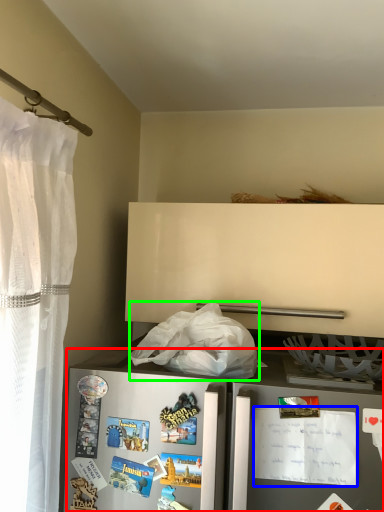
Question: Which object is the closest to the refrigerator (highlighted by a red box)? Choose among these: postcard (highlighted by a blue box) or plastic bag (highlighted by a green box).

Choices:
 (A) postcard
 (B) plastic bag

Answer: (A)